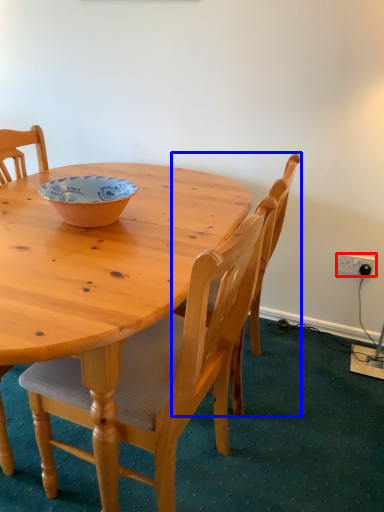
Question: Among these objects, which one is farthest to the camera, power outlet (highlighted by a red box) or chair (highlighted by a blue box)?

Choices:
 (A) power outlet
 (B) chair

Answer: (A)